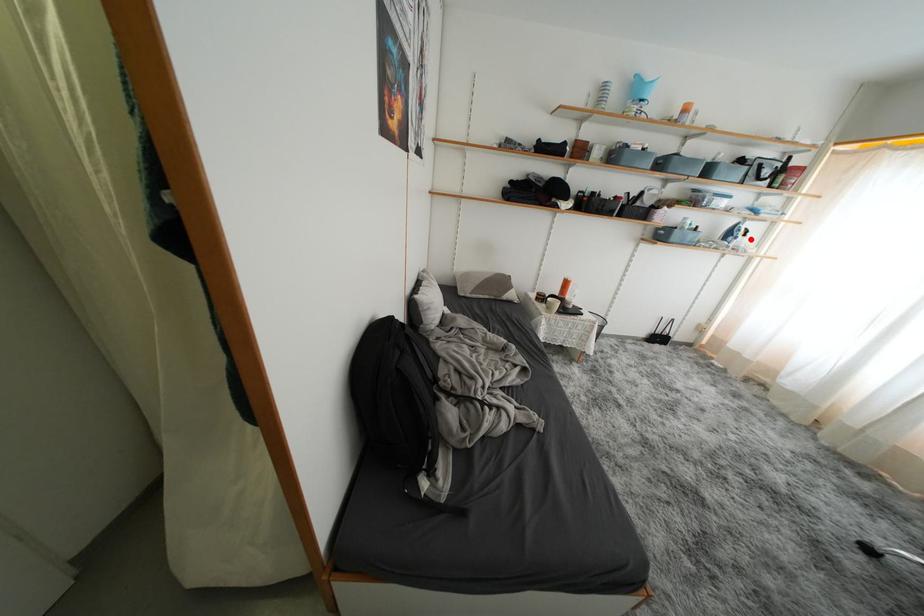
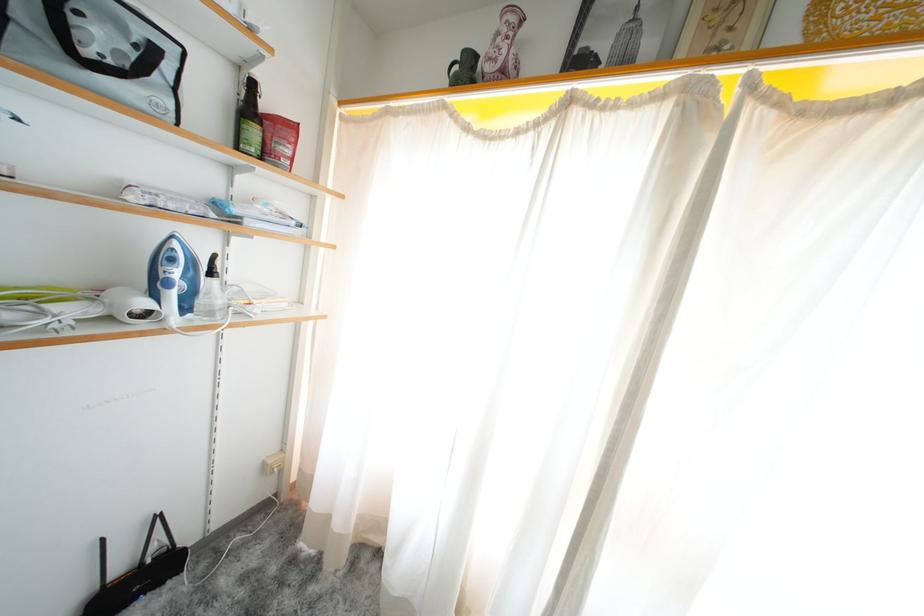
Where in the second image is the point corresponding to the highlighted location from the first image?

(217, 278)